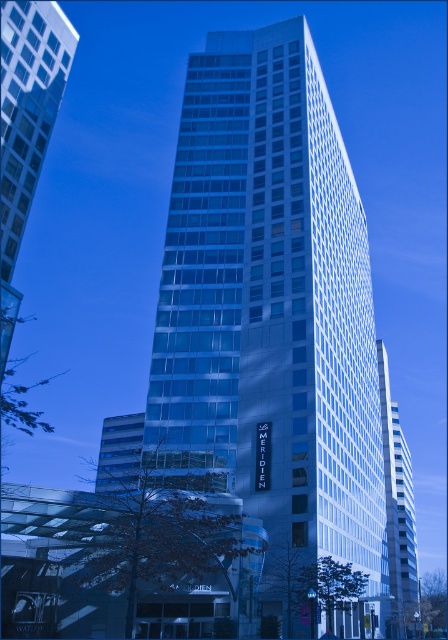
Question: Estimate the real-world distances between objects in this image. Which object is farther from the glassy white skyscraper at center?

Choices:
 (A) white glass building at center
 (B) transparent glass building at left

Answer: (A)

Question: Can you confirm if transparent glass building at left is positioned to the right of white glass building at center?

Choices:
 (A) no
 (B) yes

Answer: (A)

Question: Is transparent glass building at left positioned behind white glass building at center?

Choices:
 (A) yes
 (B) no

Answer: (B)

Question: Which object appears closest to the camera in this image?

Choices:
 (A) white glass building at center
 (B) glassy white skyscraper at center

Answer: (B)

Question: Does glassy white skyscraper at center appear on the right side of white glass building at center?

Choices:
 (A) no
 (B) yes

Answer: (A)

Question: Which object is farther from the camera taking this photo?

Choices:
 (A) white glass building at center
 (B) glassy white skyscraper at center

Answer: (A)